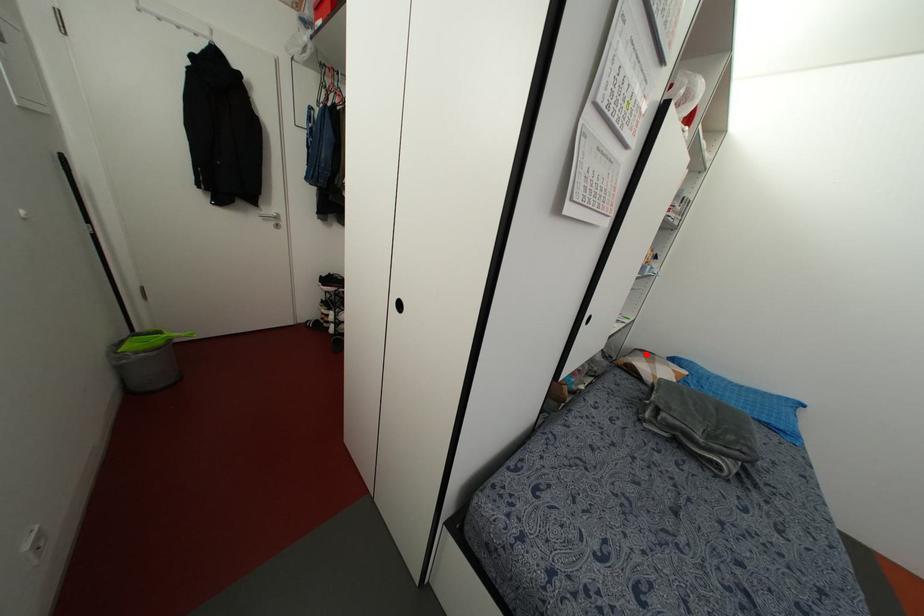
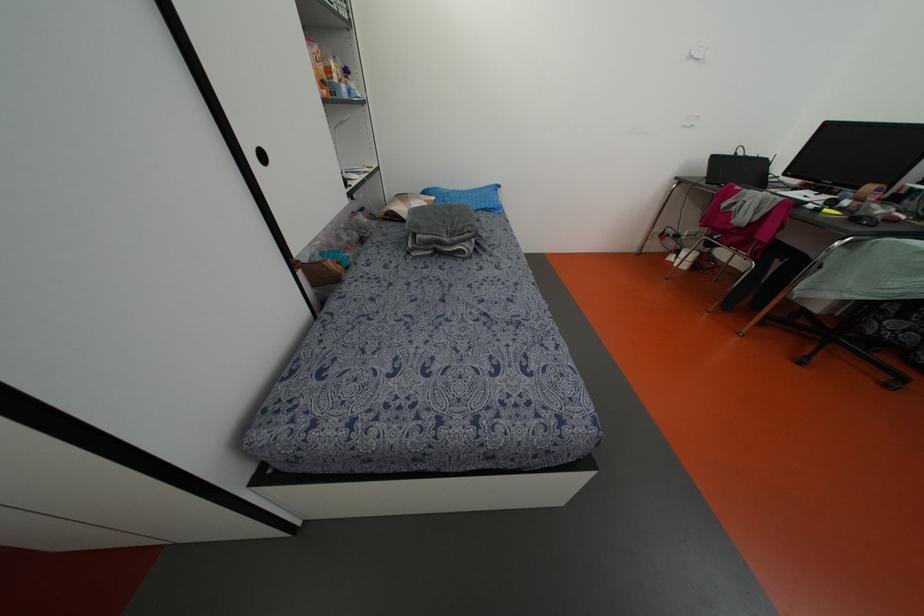
Question: I am providing you with two images of the same scene from different viewpoints. A red point is marked on the first image. At the location where the point appears in image 1, is it still visible in image 2?

Choices:
 (A) Yes
 (B) No

Answer: (A)